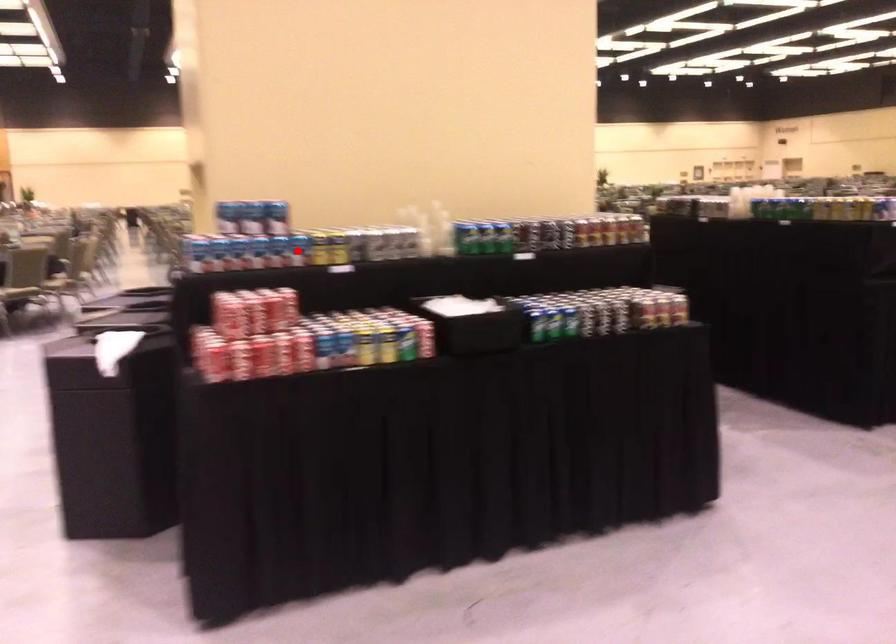
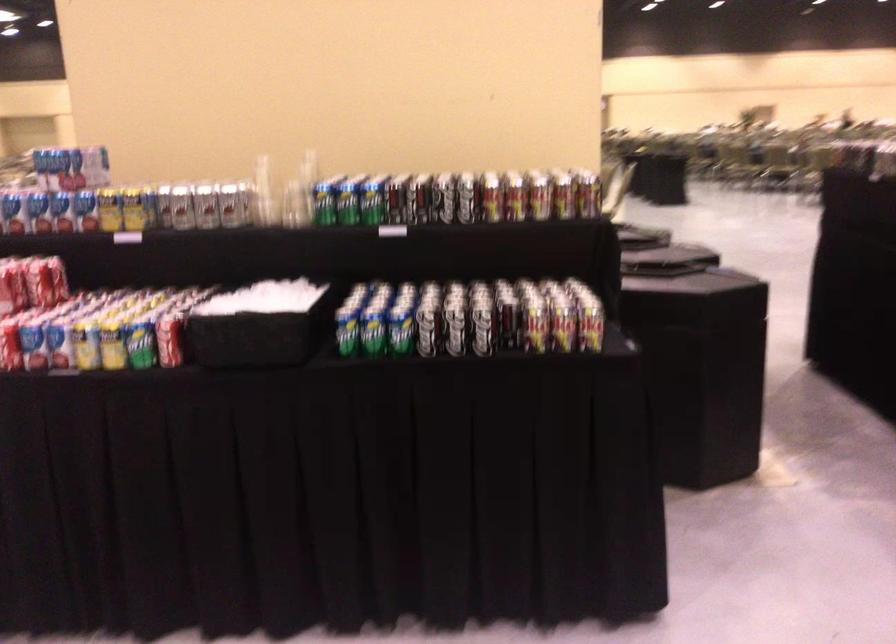
Locate, in the second image, the point that corresponds to the highlighted location in the first image.

(85, 210)